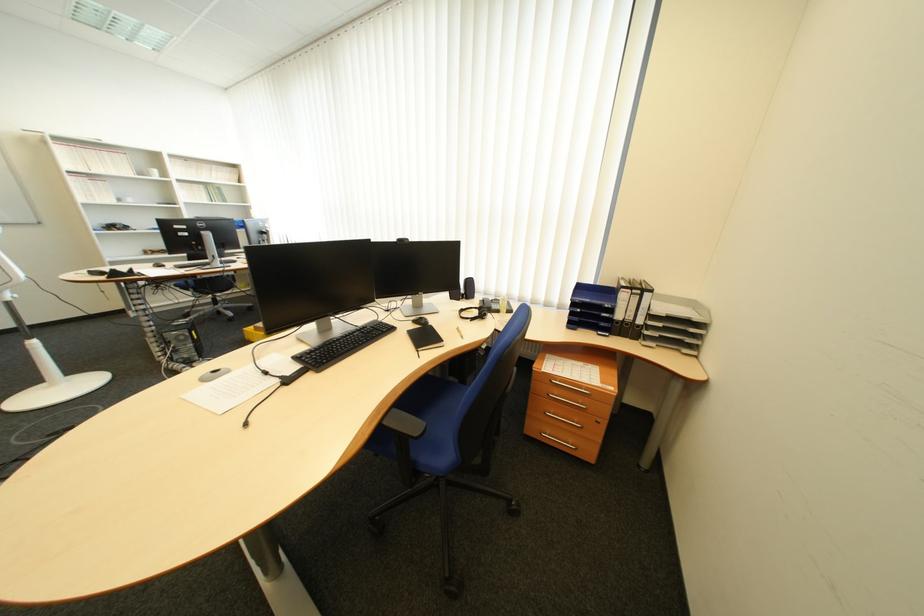
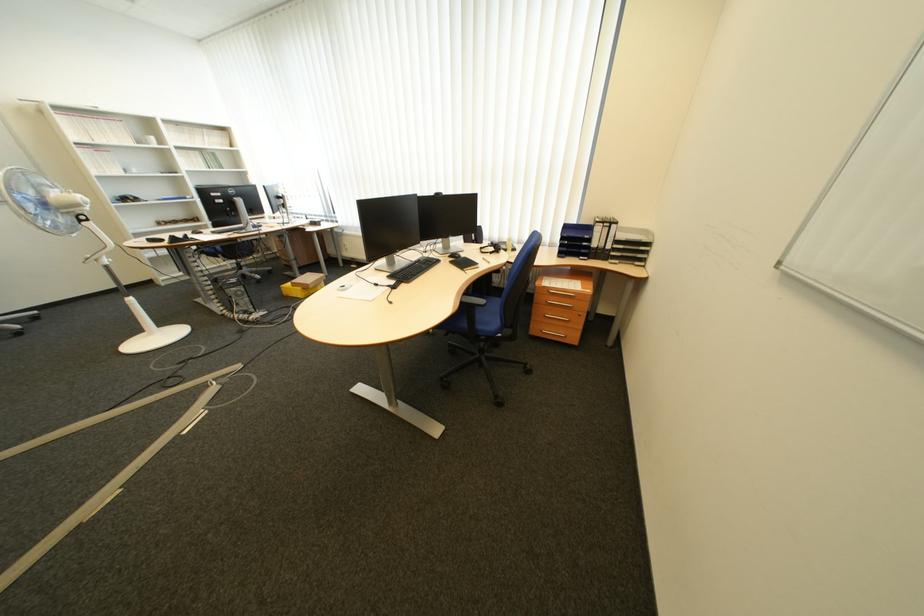
Find the pixel in the second image that matches [375,333] in the first image.

(433, 264)